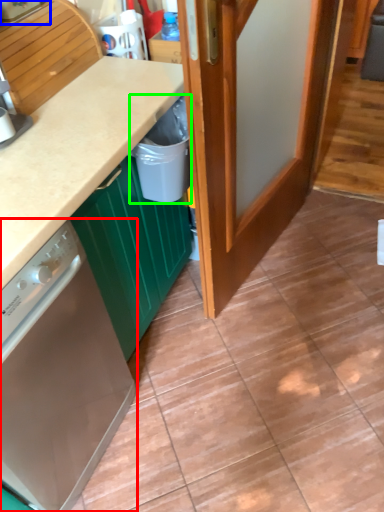
Question: Which is farther away from home appliance (highlighted by a red box)? kitchen appliance (highlighted by a blue box) or recycling bin (highlighted by a green box)?

Choices:
 (A) kitchen appliance
 (B) recycling bin

Answer: (A)